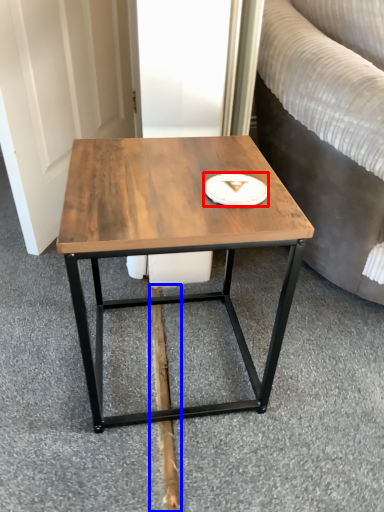
Question: Which point is closer to the camera, platter (highlighted by a red box) or plank (highlighted by a blue box)?

Choices:
 (A) platter
 (B) plank

Answer: (A)